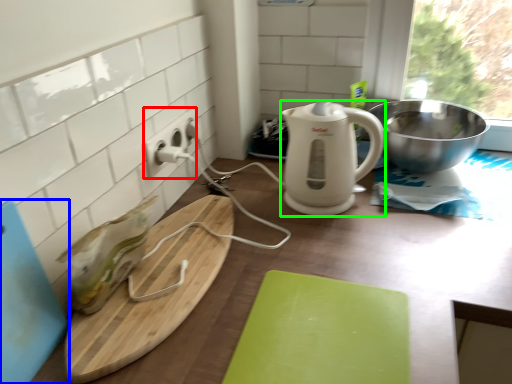
Question: Which object is positioned closest to electric outlet (highlighted by a red box)? Select from cutting board (highlighted by a blue box) and kitchen appliance (highlighted by a green box).

Choices:
 (A) cutting board
 (B) kitchen appliance

Answer: (B)